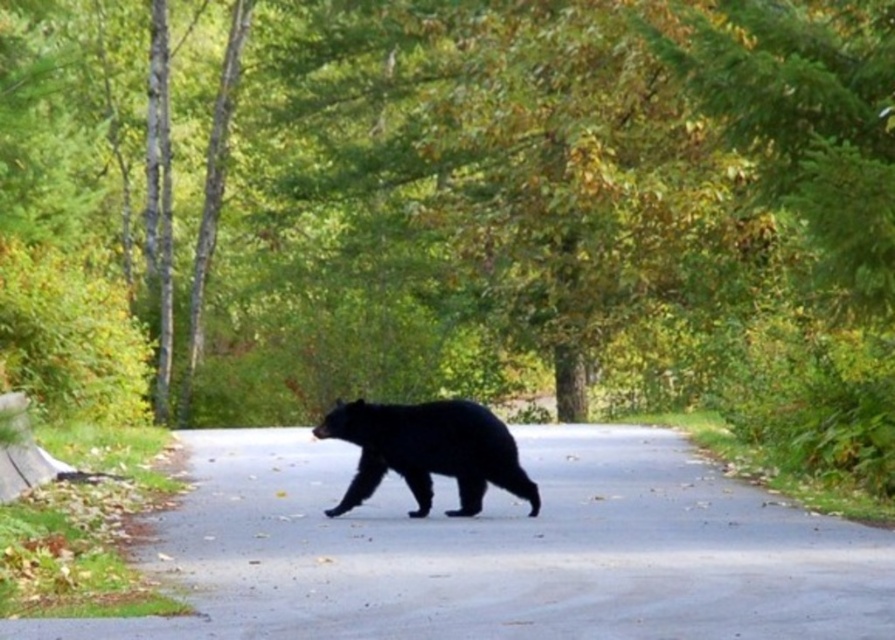
Question: Which point appears closest to the camera in this image?

Choices:
 (A) (717, 541)
 (B) (374, 428)

Answer: (A)

Question: Which point is closer to the camera?

Choices:
 (A) (385, 416)
 (B) (304, 496)

Answer: (A)

Question: Is black asphalt road at center positioned behind black fur bear at center?

Choices:
 (A) yes
 (B) no

Answer: (B)

Question: In this image, where is black asphalt road at center located relative to black fur bear at center?

Choices:
 (A) above
 (B) below

Answer: (B)

Question: Which point is closer to the camera?

Choices:
 (A) black fur bear at center
 (B) black asphalt road at center

Answer: (B)

Question: Is black asphalt road at center smaller than black fur bear at center?

Choices:
 (A) no
 (B) yes

Answer: (A)